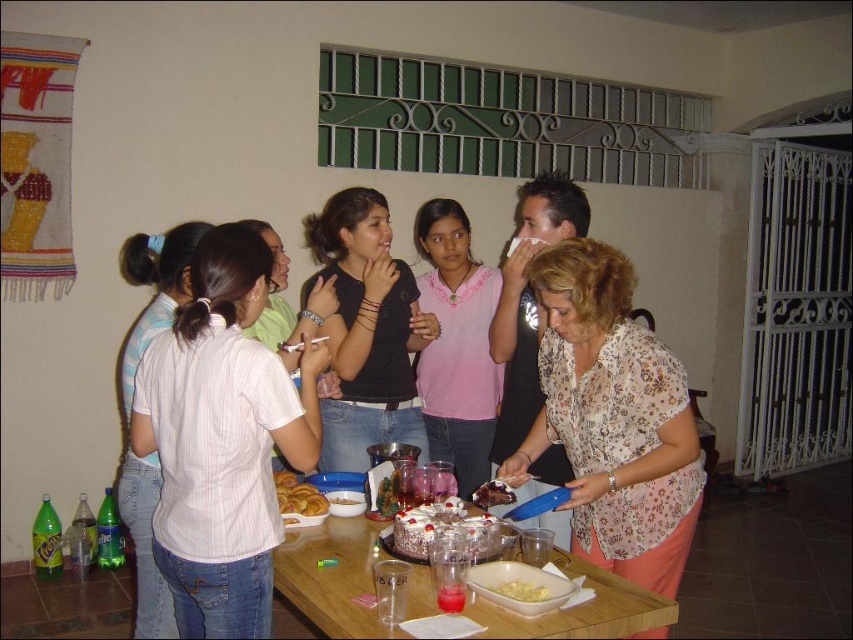
You are a guest at the party and want to grab a drink. There is a matte white cake at center and a chocolate cake at center. How far apart are these two cakes?

The distance between the matte white cake at center and chocolate cake at center is 36.87 centimeters.

You are standing at the back of the room and want to reach the two points marked in the scene. Which point, point 1 at coordinates (482, 474) or point 2 at coordinates (311, 492), is closer to you?

Point 1 at coordinates (482, 474) is closer to you since it is further to the camera than point 2 at coordinates (311, 492), meaning it is nearer in the scene.